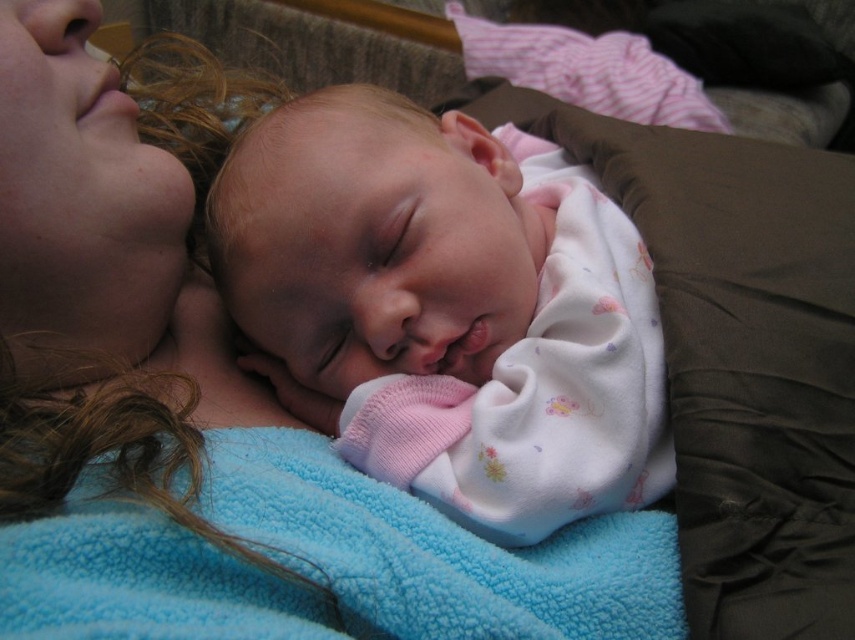
Is soft blue fleece blanket at upper left taller than blue fleece blanket at center?

Yes.

Which is in front, point (9, 481) or point (217, 432)?

Point (9, 481) is in front.

Does point (198, 385) come behind point (150, 561)?

Yes, it is.

What are the coordinates of `soft blue fleece blanket at upper left` in the screenshot? It's located at (109, 268).

Does pink cotton baby at center come behind blue fleece blanket at center?

Yes, it is.

Is point (657, 429) farther from viewer compared to point (155, 582)?

Yes, it is.

In order to click on pink cotton baby at center in this screenshot , I will do `click(450, 307)`.

Is pink cotton baby at center below soft blue fleece blanket at upper left?

Yes.

Can you confirm if pink cotton baby at center is shorter than soft blue fleece blanket at upper left?

Yes, pink cotton baby at center is shorter than soft blue fleece blanket at upper left.

Who is more forward, (494, 269) or (187, 387)?

Point (494, 269)

Where is `pink cotton baby at center`? The height and width of the screenshot is (640, 855). pink cotton baby at center is located at coordinates (450, 307).